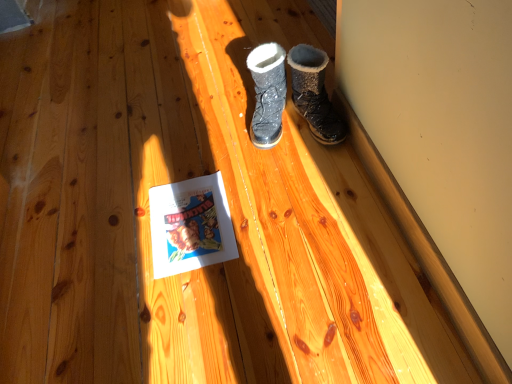
This screenshot has width=512, height=384. I want to click on free spot in front of dark brown suede boot at upper right, which ranks as the 2th footwear in left-to-right order, so click(314, 167).